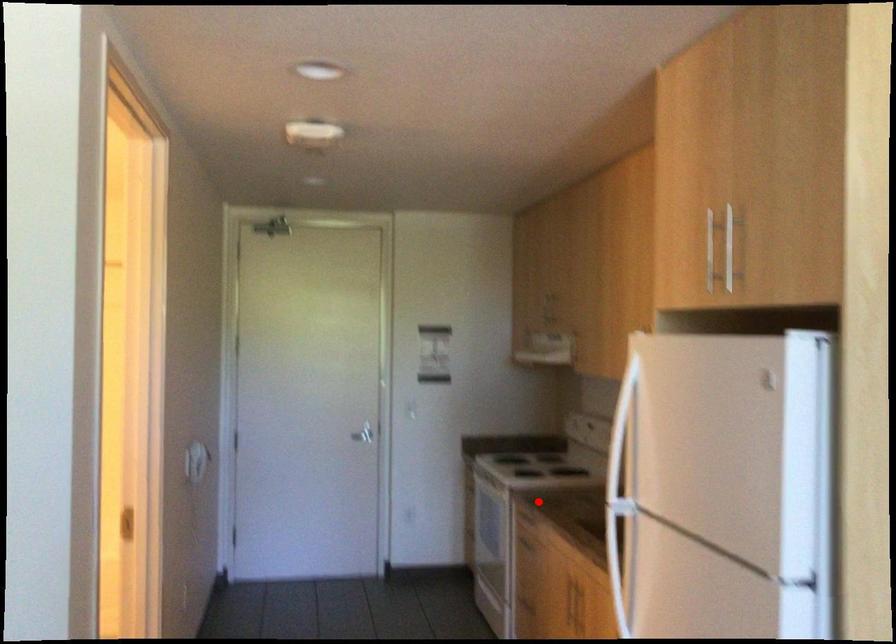
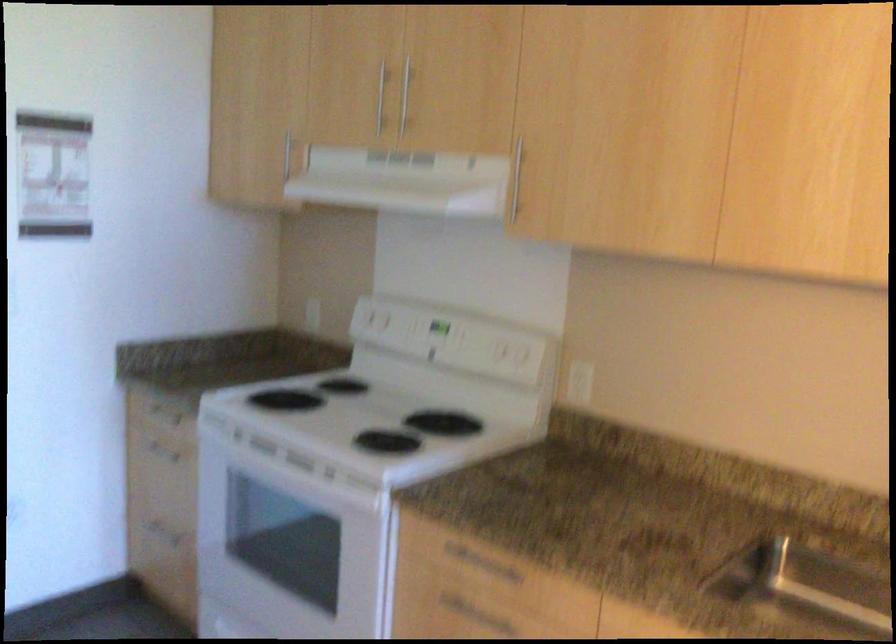
In the second image, find the point that corresponds to the highlighted location in the first image.

(480, 564)